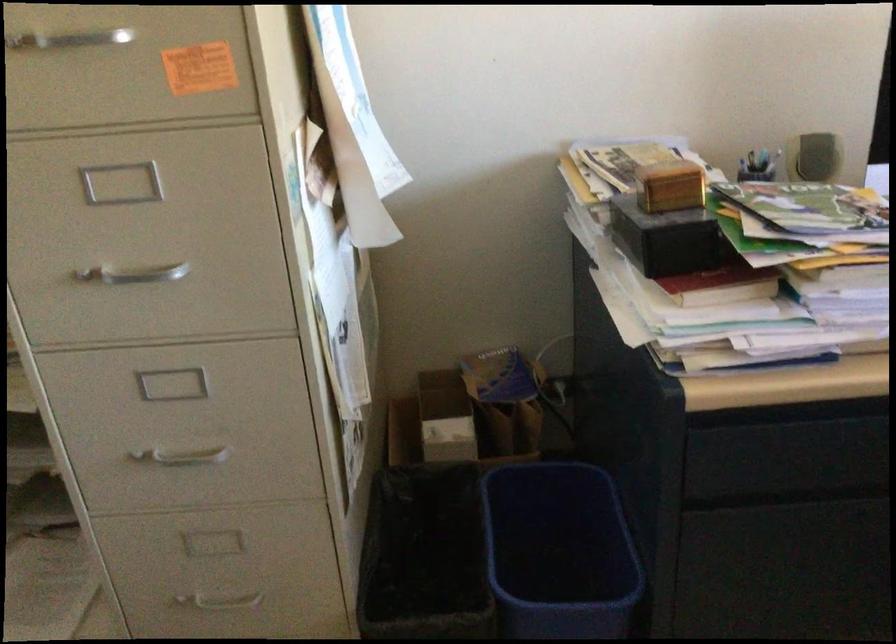
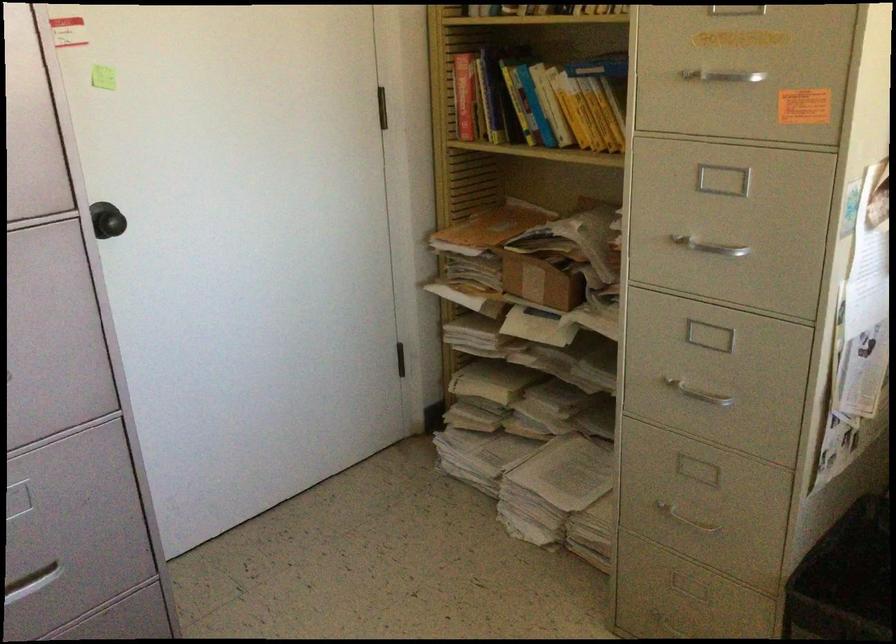
In the second image, find the point that corresponds to point 194,451 in the first image.

(699, 391)